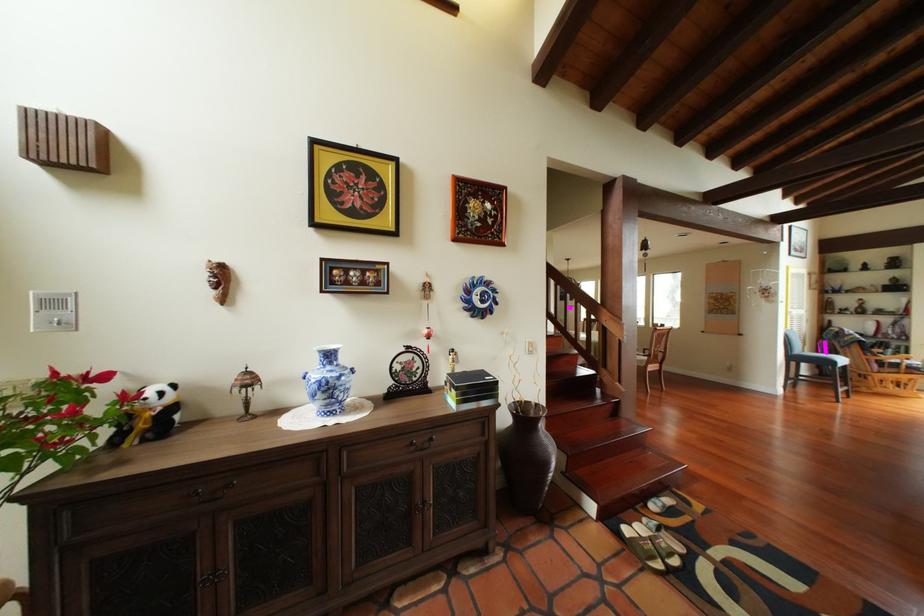
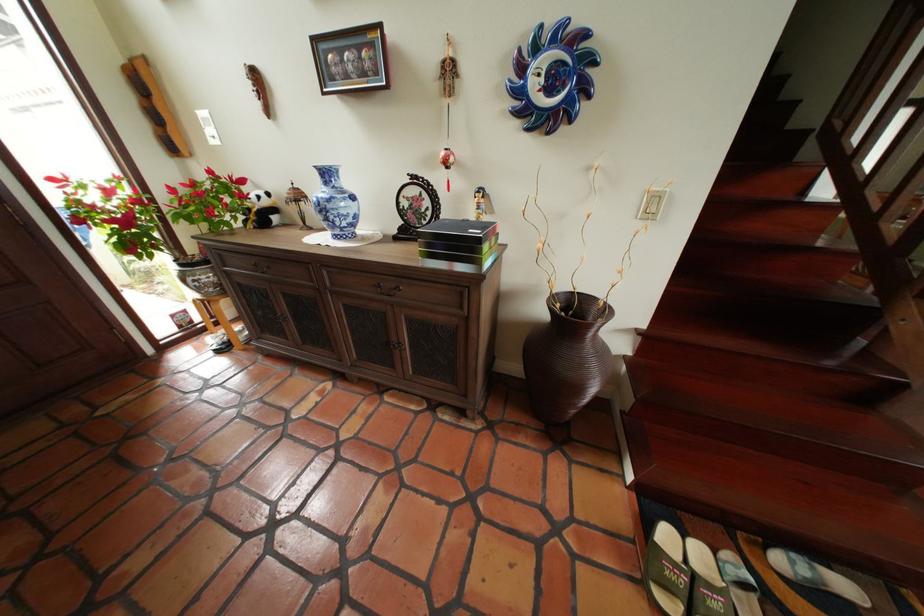
Where in the second image is the point corresponding to (x=163, y=395) from the first image?

(265, 197)